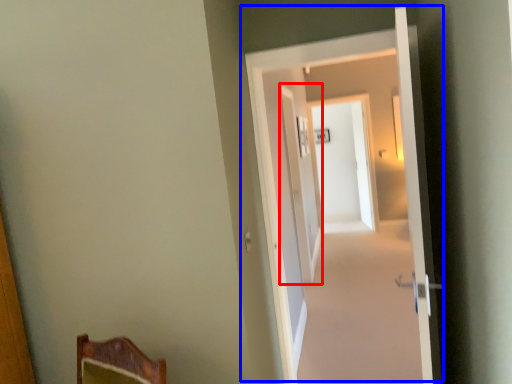
Question: Which object is closer to the camera taking this photo, screen door (highlighted by a red box) or door (highlighted by a blue box)?

Choices:
 (A) screen door
 (B) door

Answer: (B)